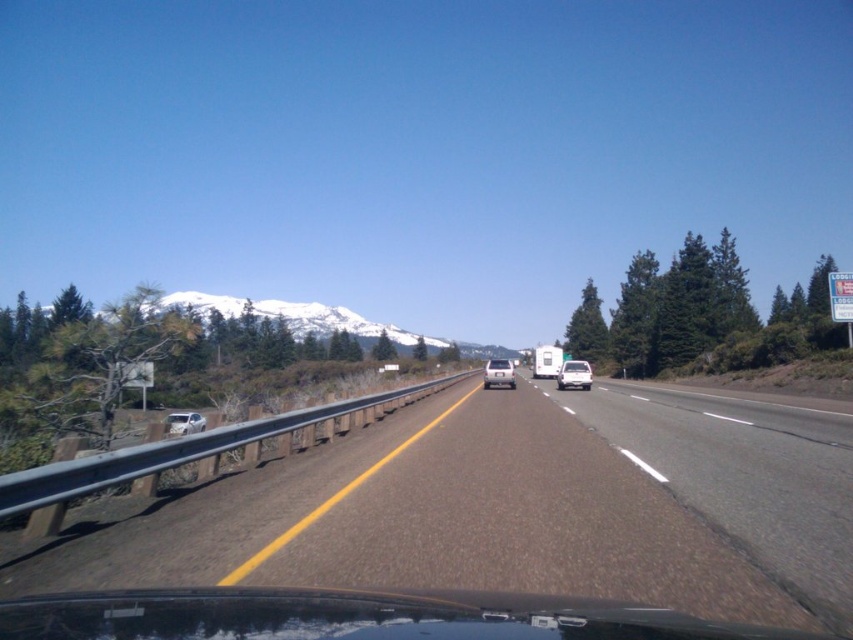
Is silver metallic car at center shorter than satin silver sedan at left?

Yes, silver metallic car at center is shorter than satin silver sedan at left.

Is point (490, 374) behind point (184, 424)?

Yes, it is behind point (184, 424).

Where is `silver metallic car at center`? The height and width of the screenshot is (640, 853). silver metallic car at center is located at coordinates (498, 372).

Between asphalt road at center and satin silver sedan at left, which one appears on the right side from the viewer's perspective?

From the viewer's perspective, asphalt road at center appears more on the right side.

Find the location of a particular element. asphalt road at center is located at coordinates (492, 512).

This screenshot has width=853, height=640. Find the location of `asphalt road at center`. asphalt road at center is located at coordinates (492, 512).

How distant is white matte truck at center from satin silver sedan at left?

The distance of white matte truck at center from satin silver sedan at left is 143.21 feet.

Is white matte truck at center below satin silver sedan at left?

No.

Is point (538, 356) behind point (193, 432)?

Yes, it is.

The image size is (853, 640). I want to click on white matte truck at center, so click(x=546, y=362).